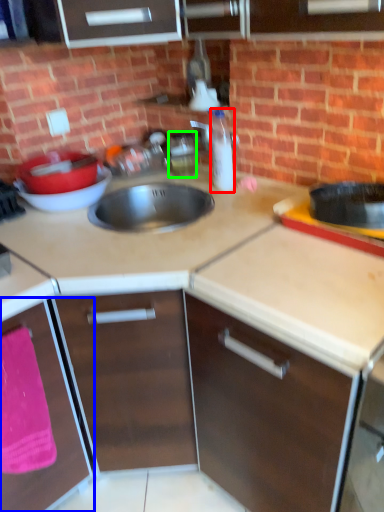
Question: Estimate the real-world distances between objects in this image. Which object is farther from bottle (highlighted by a red box), cabinetry (highlighted by a blue box) or appliance (highlighted by a green box)?

Choices:
 (A) cabinetry
 (B) appliance

Answer: (A)